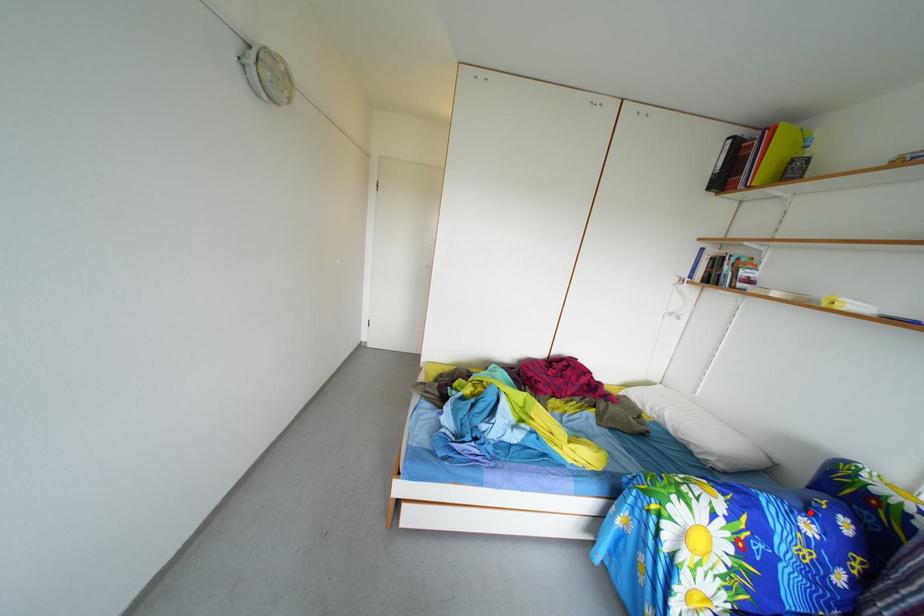
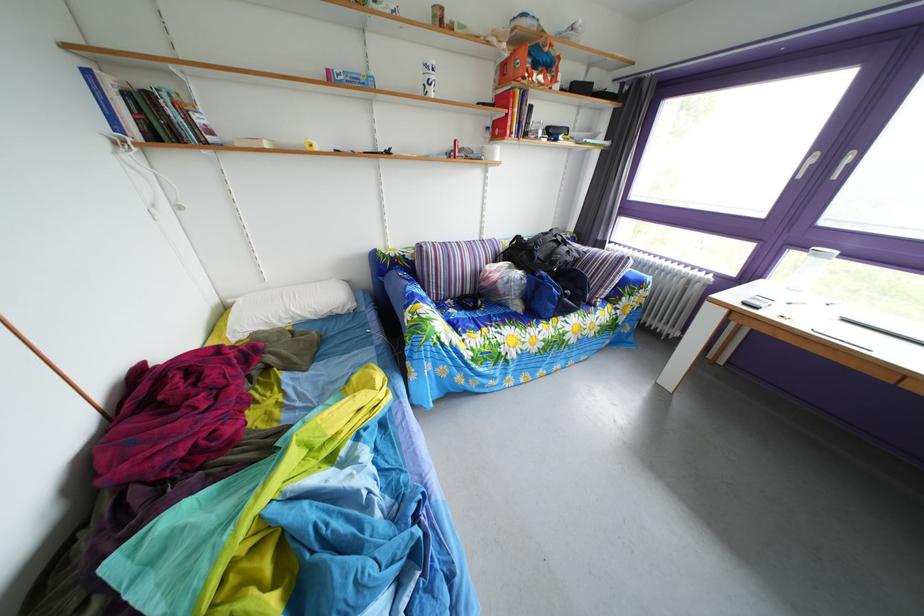
Find the pixel in the second image that matches the highlighted location in the first image.

(417, 290)